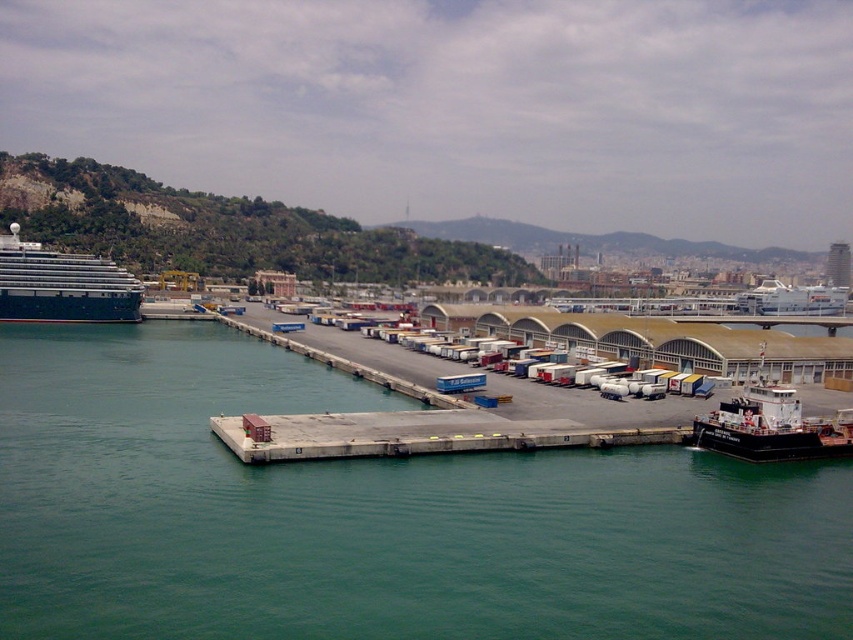
Question: Estimate the real-world distances between objects in this image. Which object is closer to the green water at lower left?

Choices:
 (A) shiny silver cruise ship at left
 (B) black matte tugboat at lower right
 (C) gray concrete dock at center

Answer: (C)

Question: Is shiny silver cruise ship at left positioned at the back of black matte tugboat at lower right?

Choices:
 (A) no
 (B) yes

Answer: (B)

Question: Is gray concrete dock at center above shiny silver cruise ship at left?

Choices:
 (A) yes
 (B) no

Answer: (B)

Question: Which is farther from the gray concrete dock at center?

Choices:
 (A) shiny silver cruise ship at left
 (B) black matte tugboat at lower right

Answer: (A)

Question: Which object is the closest to the gray concrete dock at center?

Choices:
 (A) black matte tugboat at lower right
 (B) green water at lower left
 (C) shiny silver cruise ship at left

Answer: (B)

Question: Considering the relative positions of green water at lower left and shiny silver cruise ship at left in the image provided, where is green water at lower left located with respect to shiny silver cruise ship at left?

Choices:
 (A) left
 (B) right

Answer: (B)